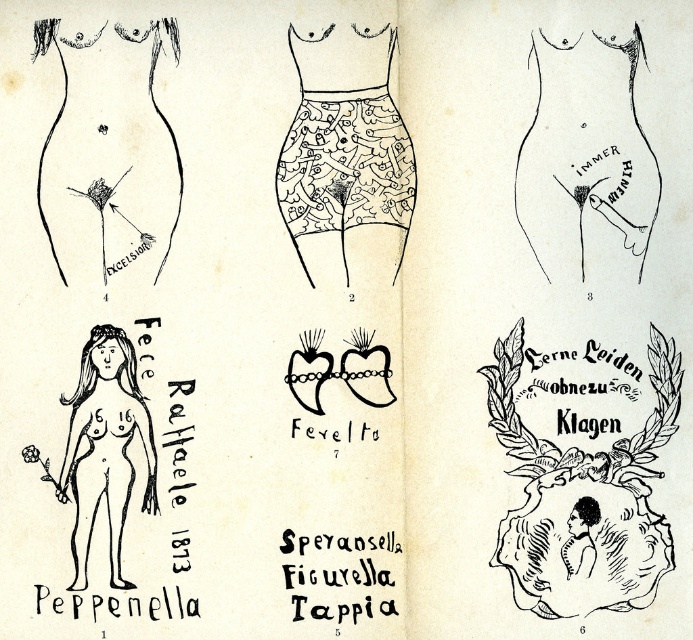
You are looking at the image and notice two points marked on it. Which of the two points, point (568, 544) or point (324, 44), is closer to you?

Point (568, 544) is closer to the viewer than point (324, 44).

Based on the scene description, can you determine the spatial relationship between the black lace underwear at center and the black line drawing nude woman at lower left?

The black lace underwear at center is above the black line drawing nude woman at lower left.

You are an interior designer who needs to place a 30 cm wide sofa between the black lace underwear at center and the black line drawing nude woman at lower left. Is there enough space between them to fit the sofa?

The distance between the black lace underwear at center and the black line drawing nude woman at lower left is 27.47 centimeters. Since the sofa is 30 cm wide, it won not fit between them as the space is smaller than the sofa.